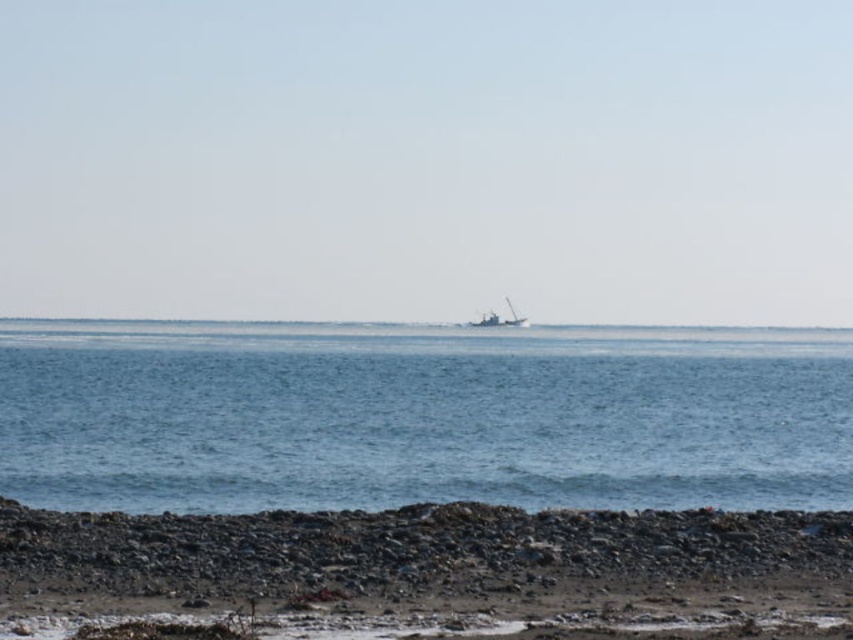
This screenshot has height=640, width=853. Find the location of `blue water at center`. blue water at center is located at coordinates (421, 416).

Between point (115, 442) and point (468, 528), which one is positioned in front?

Point (468, 528) is in front.

Identify the location of blue water at center. The image size is (853, 640). (421, 416).

Is rough textured rocks at lower center closer to camera compared to metallic gray boat at center?

Yes.

Is rough textured rocks at lower center bigger than metallic gray boat at center?

No.

Does point (376, 512) come farther from viewer compared to point (490, 314)?

No, (376, 512) is closer to viewer.

Locate an element on the screen. rough textured rocks at lower center is located at coordinates (412, 550).

Between blue water at center and metallic gray boat at center, which one appears on the right side from the viewer's perspective?

metallic gray boat at center

Can you confirm if blue water at center is bigger than metallic gray boat at center?

Correct, blue water at center is larger in size than metallic gray boat at center.

At what (x,y) coordinates should I click in order to perform the action: click on blue water at center. Please return your answer as a coordinate pair (x, y). Looking at the image, I should click on (421, 416).